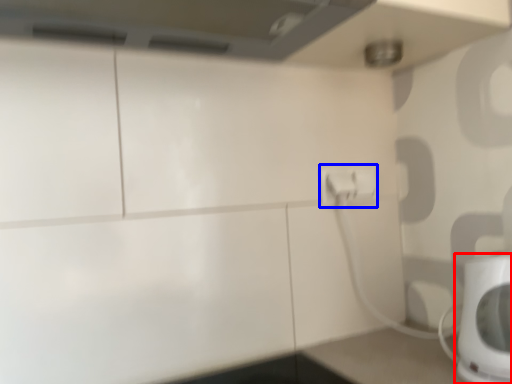
Question: Which point is closer to the camera, home appliance (highlighted by a red box) or electric outlet (highlighted by a blue box)?

Choices:
 (A) home appliance
 (B) electric outlet

Answer: (A)